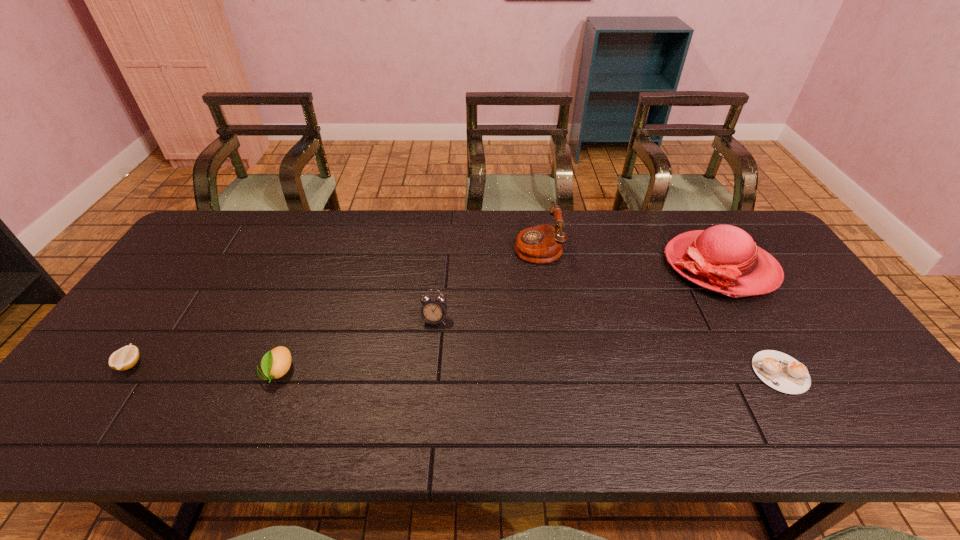
Where is `free spot between the hat and the fourth shortest object`? The image size is (960, 540). free spot between the hat and the fourth shortest object is located at coordinates (577, 293).

You are a GUI agent. You are given a task and a screenshot of the screen. Output one action in this format:
    pyautogui.click(x=<x>, y=<y>)
    Task: Click on the free spot between the shortest object and the right lemon
    The image size is (960, 540).
    Given the screenshot: What is the action you would take?
    pyautogui.click(x=529, y=372)

Locate an element on the screen. The height and width of the screenshot is (540, 960). vacant space that's between the taller lemon and the telephone is located at coordinates (408, 309).

Locate an element on the screen. unoccupied position between the fifth object from right to left and the hat is located at coordinates (499, 319).

Locate an element on the screen. The width and height of the screenshot is (960, 540). free space between the telephone and the hat is located at coordinates (629, 256).

You are a GUI agent. You are given a task and a screenshot of the screen. Output one action in this format:
    pyautogui.click(x=<x>, y=<y>)
    Task: Click on the free spot between the fourth nearest object and the fourth object from left to right
    Image resolution: width=960 pixels, height=540 pixels.
    Given the screenshot: What is the action you would take?
    pyautogui.click(x=486, y=283)

Identify the location of unoccupied position between the shortest object and the left lemon. The height and width of the screenshot is (540, 960). (455, 368).

Image resolution: width=960 pixels, height=540 pixels. What are the coordinates of `blank region between the hat and the third object from right to left` in the screenshot? It's located at (629, 256).

The width and height of the screenshot is (960, 540). Find the location of `vacant area between the third object from right to left and the hat`. vacant area between the third object from right to left and the hat is located at coordinates (629, 256).

Identify which object is the nearest to the third tallest object. Please provide its 2D coordinates. Your answer should be formatted as a tuple, i.e. [(x, y)], where the tuple contains the x and y coordinates of a point satisfying the conditions above.

[(541, 244)]